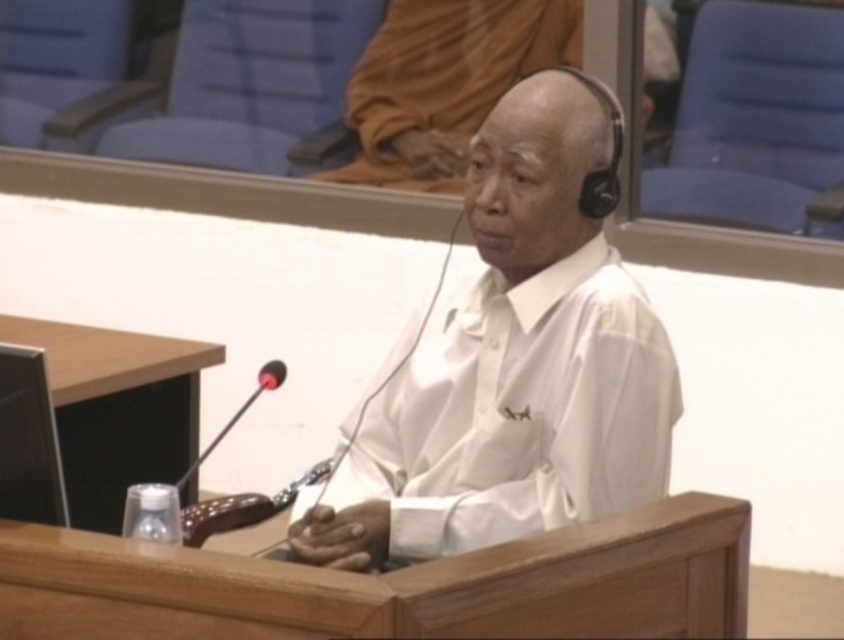
Question: Among these objects, which one is farthest from the camera?

Choices:
 (A) black plastic microphone at lower center
 (B) white matte shirt at center

Answer: (B)

Question: Can you confirm if white matte shirt at center is bigger than black plastic microphone at lower center?

Choices:
 (A) yes
 (B) no

Answer: (A)

Question: Which object appears closest to the camera in this image?

Choices:
 (A) white matte shirt at center
 (B) black plastic microphone at lower center

Answer: (B)

Question: Among these objects, which one is nearest to the camera?

Choices:
 (A) black plastic microphone at lower center
 (B) white matte shirt at center

Answer: (A)

Question: Considering the relative positions of white matte shirt at center and black plastic microphone at lower center in the image provided, where is white matte shirt at center located with respect to black plastic microphone at lower center?

Choices:
 (A) left
 (B) right

Answer: (B)

Question: Is white matte shirt at center smaller than black plastic microphone at lower center?

Choices:
 (A) yes
 (B) no

Answer: (B)